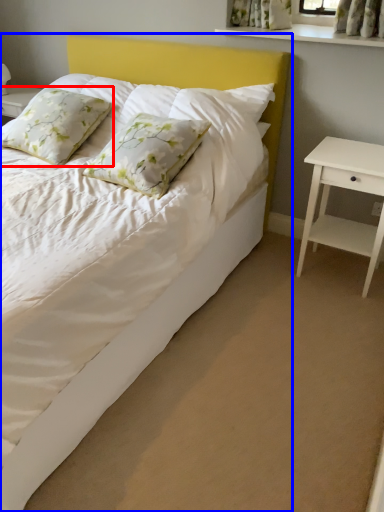
Question: Which object appears farthest to the camera in this image, pillow (highlighted by a red box) or bed (highlighted by a blue box)?

Choices:
 (A) pillow
 (B) bed

Answer: (A)